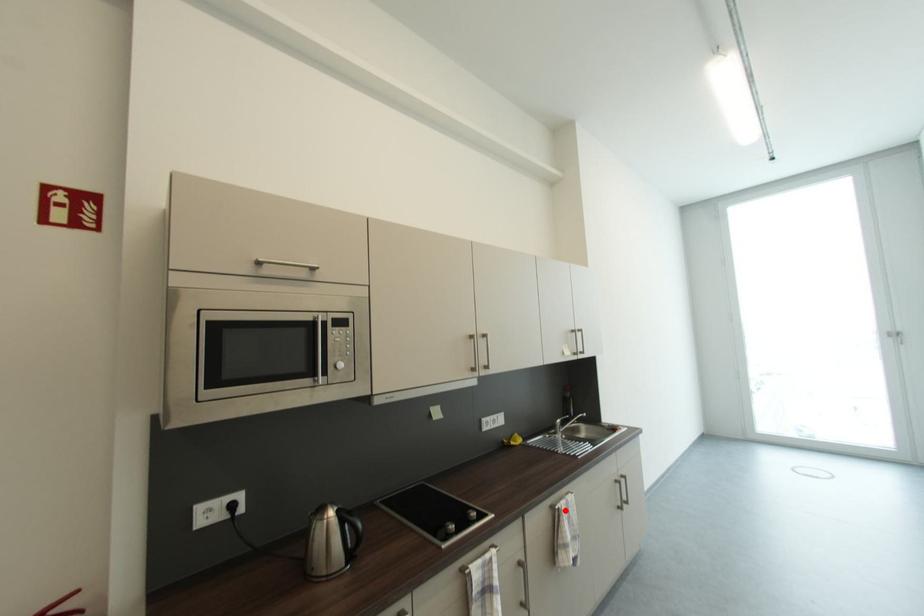
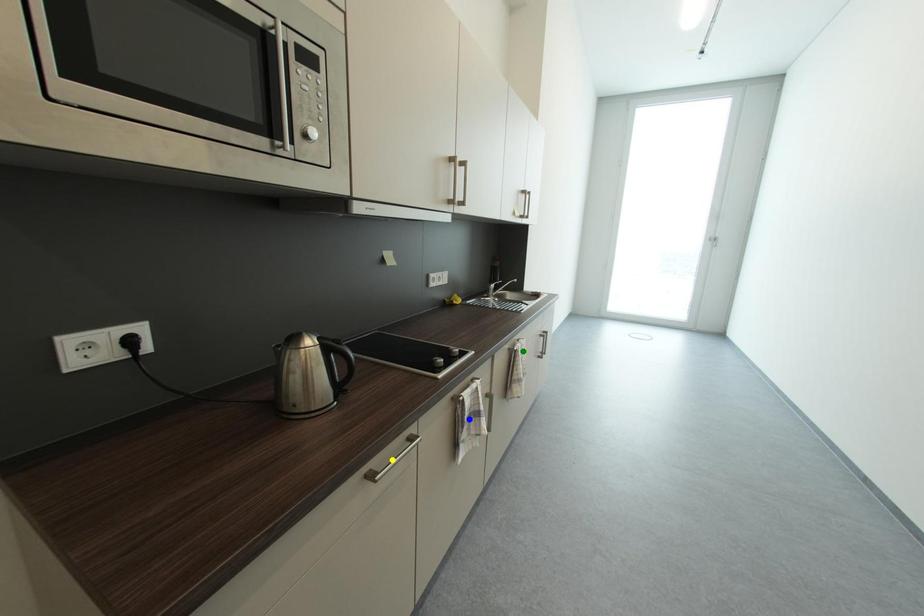
Question: I am providing you with two images of the same scene from different viewpoints. A red point is marked on the first image. You are given multiple points on the second image. In image 2, which mark is for the same physical point as the one in image 1?

Choices:
 (A) blue point
 (B) yellow point
 (C) green point

Answer: (C)